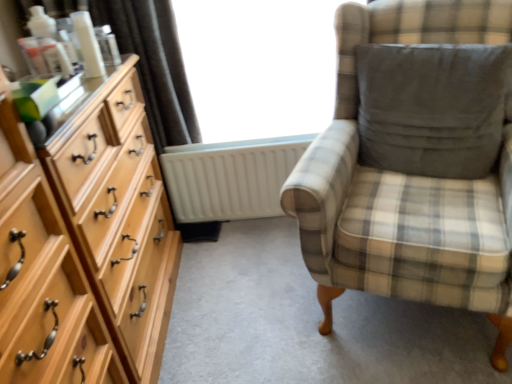
This screenshot has height=384, width=512. What are the coordinates of `blank space above white matte radiator at center (from a real-world perspective)` in the screenshot? It's located at (248, 147).